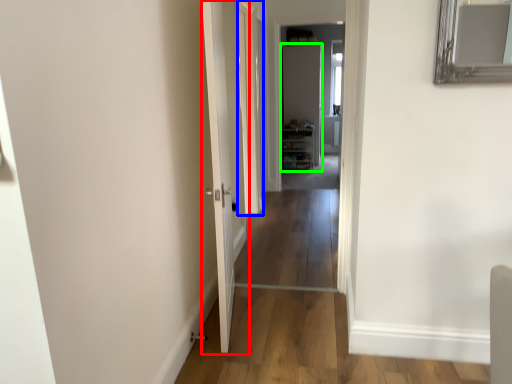
Question: Estimate the real-world distances between objects in this image. Which object is farther from door (highlighted by a red box), glass door (highlighted by a blue box) or door (highlighted by a green box)?

Choices:
 (A) glass door
 (B) door

Answer: (B)